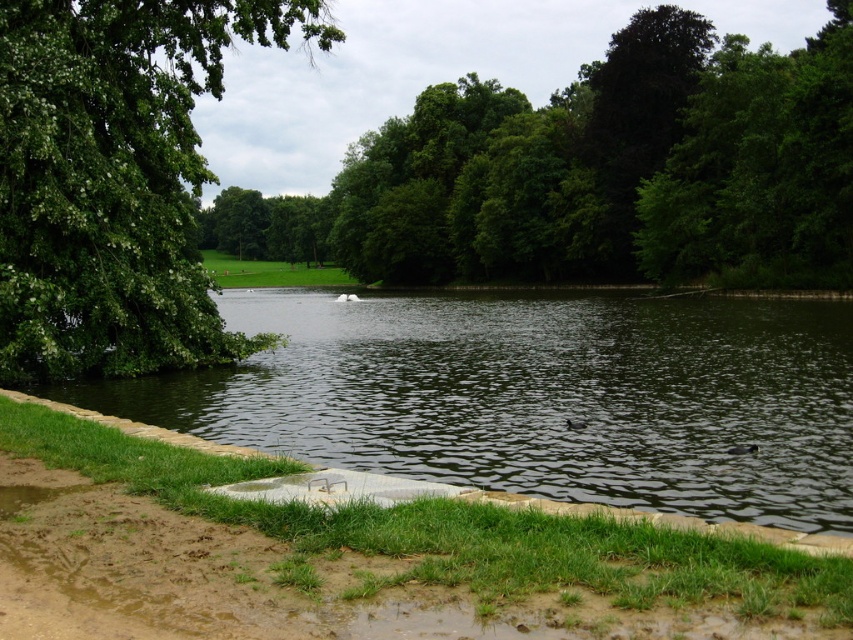
Question: Does green leafy tree at upper center appear on the right side of green leafy tree at upper left?

Choices:
 (A) yes
 (B) no

Answer: (A)

Question: Which point is closer to the camera taking this photo?

Choices:
 (A) pyautogui.click(x=560, y=330)
 (B) pyautogui.click(x=509, y=211)

Answer: (A)

Question: Can you confirm if dark green water at center is positioned below green leafy tree at upper center?

Choices:
 (A) no
 (B) yes

Answer: (B)

Question: Considering the real-world distances, which object is closest to the green leafy tree at upper left?

Choices:
 (A) green leafy tree at upper center
 (B) dark green water at center

Answer: (B)

Question: Which object is positioned closest to the green leafy tree at upper center?

Choices:
 (A) dark green water at center
 (B) green leafy tree at upper left

Answer: (A)

Question: Can you confirm if dark green water at center is positioned to the right of green leafy tree at upper center?

Choices:
 (A) yes
 (B) no

Answer: (B)